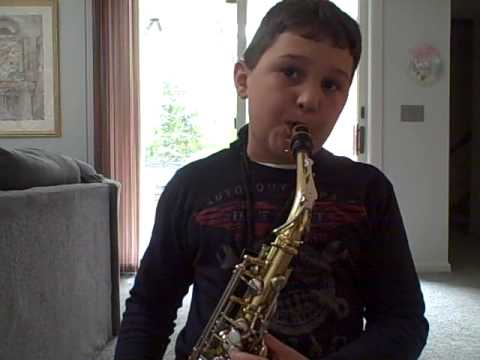
I want to click on painting, so click(x=26, y=104).